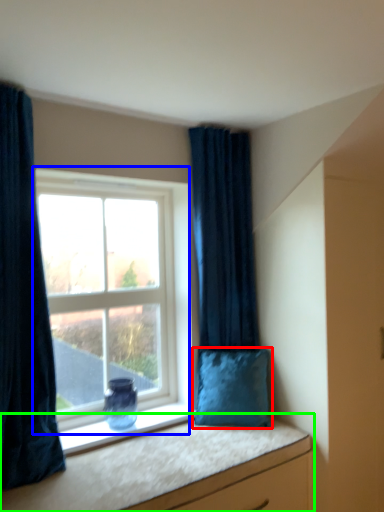
Question: Estimate the real-world distances between objects in this image. Which object is farther from pillow (highlighted by a red box), window (highlighted by a blue box) or vanity (highlighted by a green box)?

Choices:
 (A) window
 (B) vanity

Answer: (A)